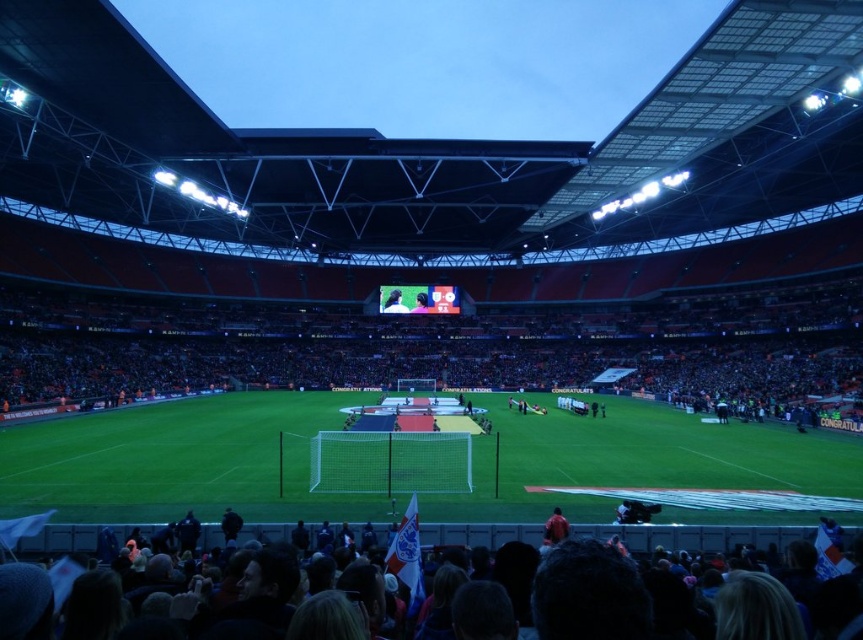
Question: Which point is closer to the camera?

Choices:
 (A) smooth black shirt at center
 (B) green grass football field at center

Answer: (B)

Question: From the image, what is the correct spatial relationship of dark orange stadium seats at center in relation to smooth black shirt at center?

Choices:
 (A) left
 (B) right

Answer: (B)

Question: Which point is closer to the camera?

Choices:
 (A) dark hair at lower center
 (B) smooth skin face at center
 (C) dark orange stadium seats at center

Answer: (A)

Question: Is dark hair at lower center positioned in front of smooth black shirt at center?

Choices:
 (A) yes
 (B) no

Answer: (A)

Question: Observing the image, what is the correct spatial positioning of dark hair at lower center in reference to green fabric jacket at lower right?

Choices:
 (A) below
 (B) above

Answer: (B)

Question: Which point appears closest to the camera in this image?

Choices:
 (A) (808, 531)
 (B) (424, 300)
 (C) (394, 305)

Answer: (A)